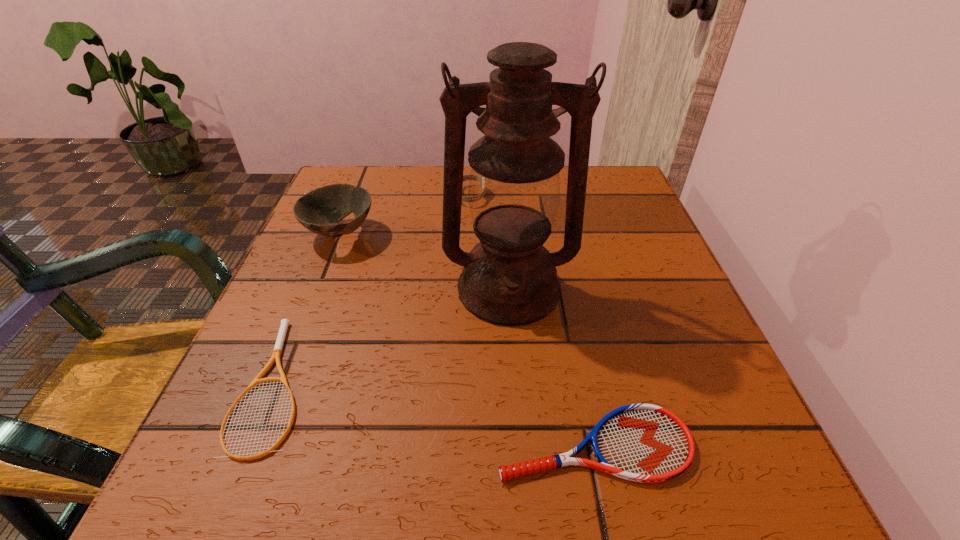
At what (x,y) coordinates should I click in order to perform the action: click on free space that satisfies the following two spatial constraints: 1. on the back side of the shorter tennis racket; 2. on the right side of the bowl. Please return your answer as a coordinate pair (x, y). The width and height of the screenshot is (960, 540). Looking at the image, I should click on (337, 234).